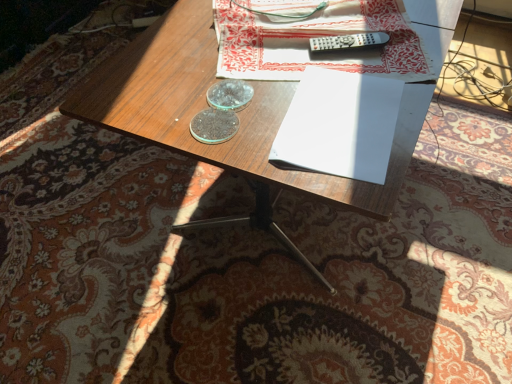
I want to click on free space above white paper at center (from a real-world perspective), so click(x=348, y=114).